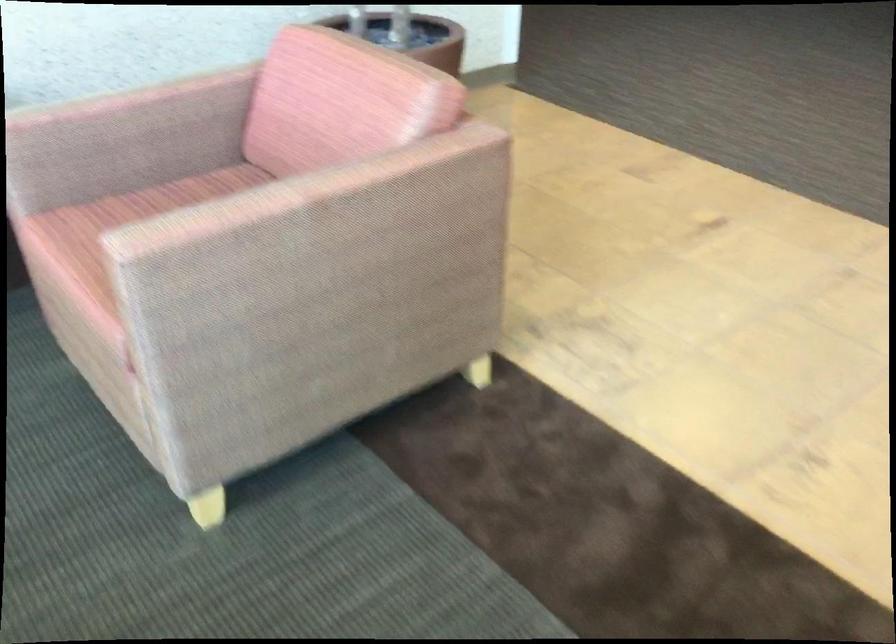
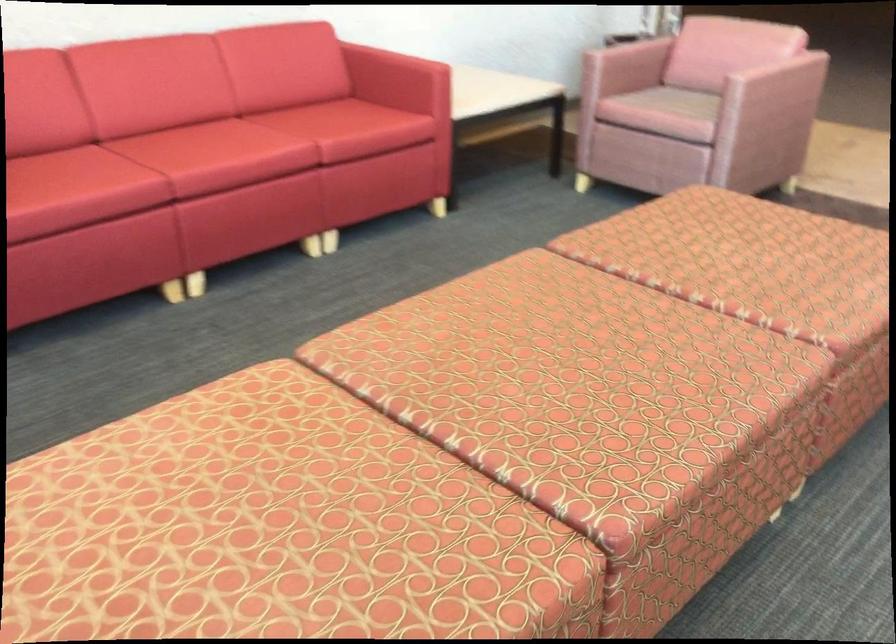
In the second image, find the point that corresponds to point 346,240 in the first image.

(773, 90)